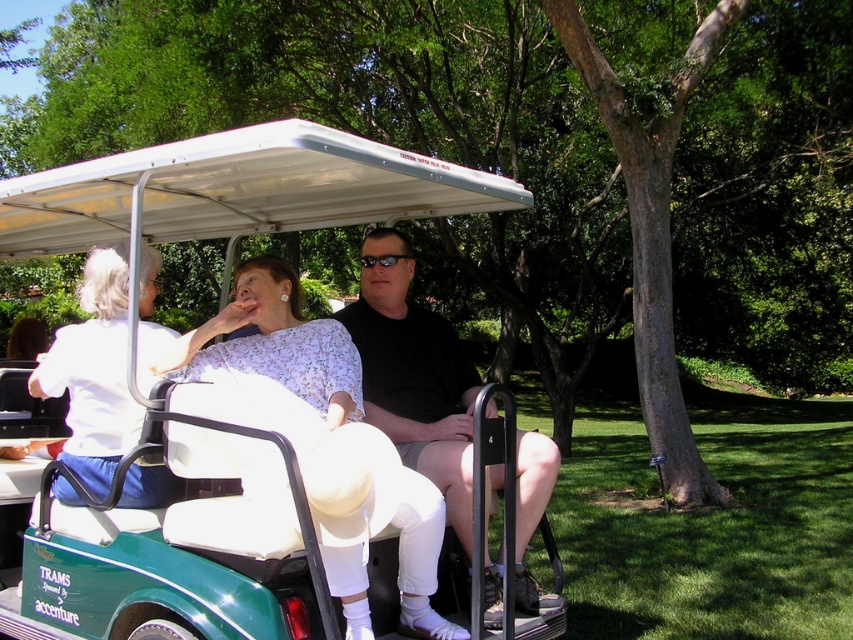
You are a delivery robot that needs to place a package on the green matte golf cart at center without touching the floral fabric blouse at center. Is there enough space between them to do this safely?

The green matte golf cart at center and the floral fabric blouse at center are 32.78 inches apart, so there is sufficient space to place the package safely without touching the blouse.

You are a fashion designer observing the image. You need to determine if the distance between the floral fabric blouse at center and the black plastic sunglasses at center is sufficient to place a 20 inch accessory between them. Can you confirm?

A: The distance between the floral fabric blouse at center and the black plastic sunglasses at center is 38.35 inches. Since the accessory is 20 inches long, there is enough space to place it between them as 38.35 inches is greater than 20 inches.

Consider the image. You are a designer trying to create a catalog for outdoor apparel. You need to determine which item is wider between the floral fabric blouse at center and the black plastic sunglasses at center. Which one is wider?

The floral fabric blouse at center is wider than the black plastic sunglasses at center according to the description.